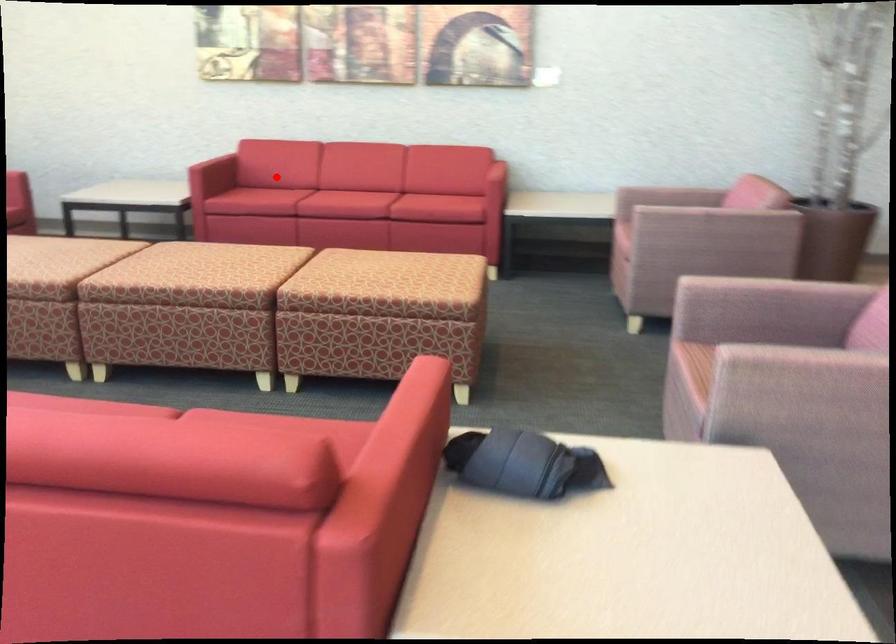
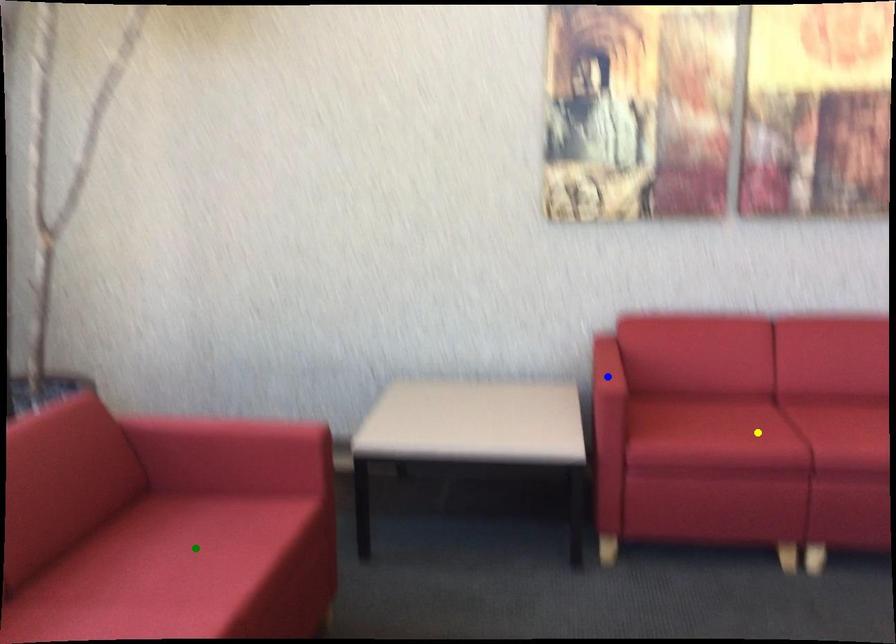
Question: I am providing you with two images of the same scene from different viewpoints. A red point is marked on the first image. You are given multiple points on the second image. Which point in image 2 is actually the same real-world point as the red point in image 1?

Choices:
 (A) yellow point
 (B) blue point
 (C) green point

Answer: (A)